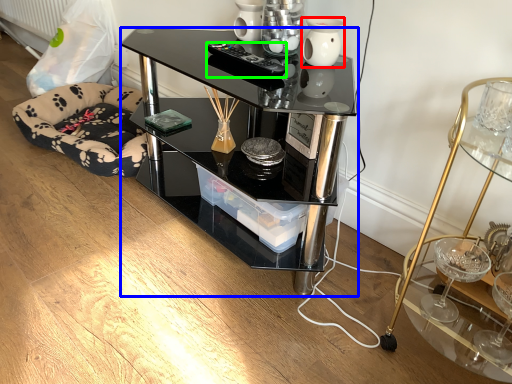
Question: Which is nearer to the vase (highlighted by a red box)? desk (highlighted by a blue box) or remote control (highlighted by a green box).

Choices:
 (A) desk
 (B) remote control

Answer: (B)